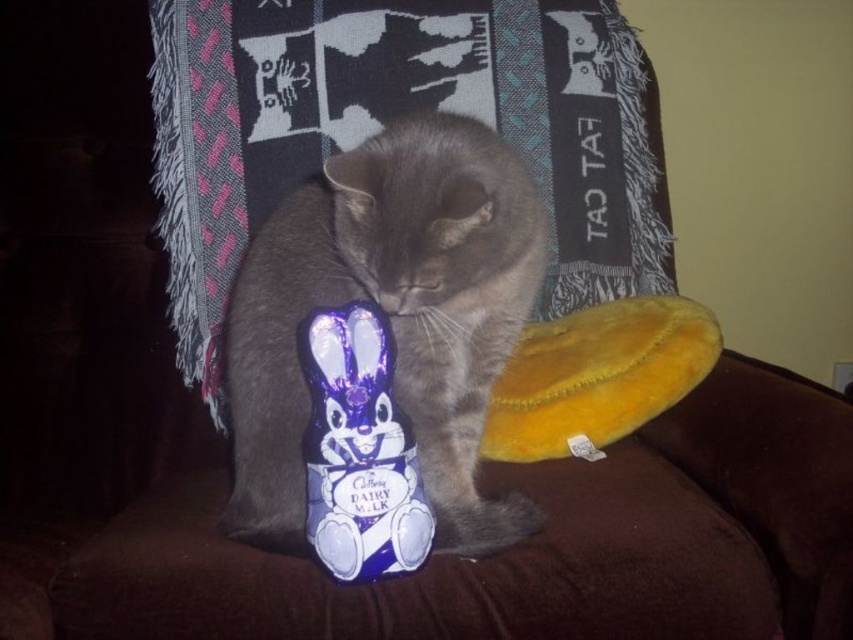
Can you confirm if gray fur cat at center is bigger than blue shiny chocolate at center?

Indeed, gray fur cat at center has a larger size compared to blue shiny chocolate at center.

Describe the element at coordinates (390, 316) in the screenshot. I see `gray fur cat at center` at that location.

The image size is (853, 640). Find the location of `gray fur cat at center`. gray fur cat at center is located at coordinates (390, 316).